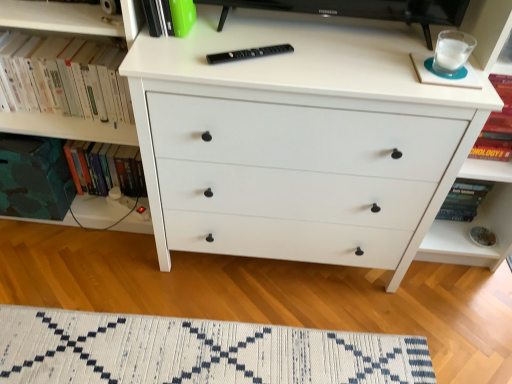
Question: Based on their sizes in the image, would you say white matte chest of drawers at center is bigger or smaller than white paperbacks at left, acting as the second book starting from the front?

Choices:
 (A) big
 (B) small

Answer: (A)

Question: Considering their positions, is white matte chest of drawers at center located in front of or behind white paperbacks at left, the 2th book positioned from the back?

Choices:
 (A) behind
 (B) front

Answer: (B)

Question: Which is nearer to the camouflage fabric book at lower left?

Choices:
 (A) white paperbacks at left, acting as the second book starting from the front
 (B) hardcover book at left, arranged as the 1th book when viewed from the back
 (C) white matte chest of drawers at center
 (D) green matte book at upper center, which is counted as the third book, starting from the back
 (E) white woven mat at lower center

Answer: (B)

Question: Based on their relative distances, which object is nearer to the white paperbacks at left, acting as the second book starting from the front?

Choices:
 (A) green matte book at upper center, which is counted as the first book, starting from the front
 (B) white matte chest of drawers at center
 (C) hardcover book at left, marked as the 3th book in a front-to-back arrangement
 (D) camouflage fabric book at lower left
 (E) white woven mat at lower center

Answer: (D)